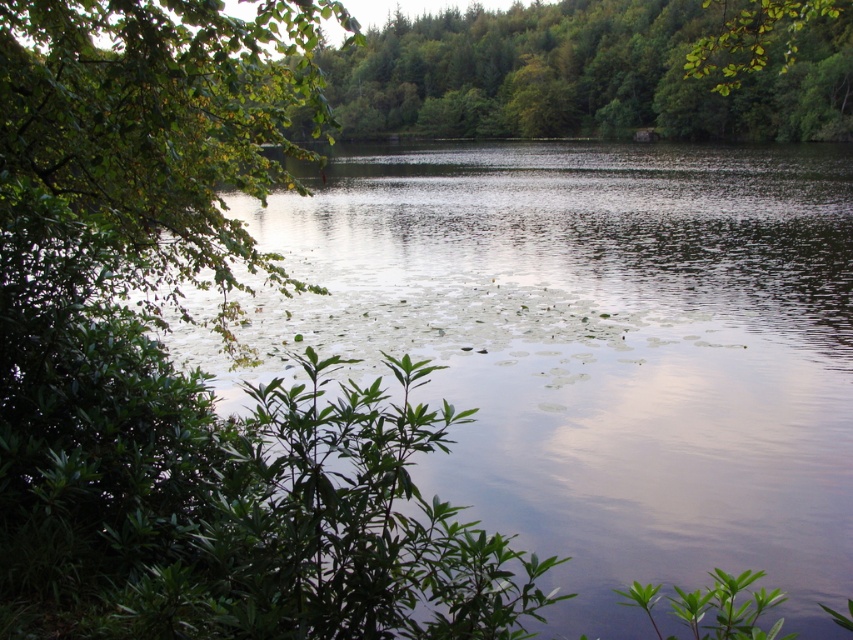
You are an environmental scientist studying the trees in this natural setting. You need to determine which tree has a wider spread. Which one is wider between the green leafy tree at left and the green leafy tree at center?

The green leafy tree at center is wider than the green leafy tree at left, as the description states that the green leafy tree at left has a smaller width compared to the one at center.

You are standing in the serene natural scene and want to take a photo of both the green leafy river at left and the green leafy tree at left. Which object should you focus on first if you want to capture both in a single frame without moving your camera?

You should focus on the green leafy tree at left first because it is taller than the green leafy river at left, allowing you to frame it at the top while including the river below.

You are standing at the center of the image and want to walk towards the point marked by point (595, 348). Which direction should you head?

The point (595, 348) is located at the left side of the image, so you should head towards the left to reach it.